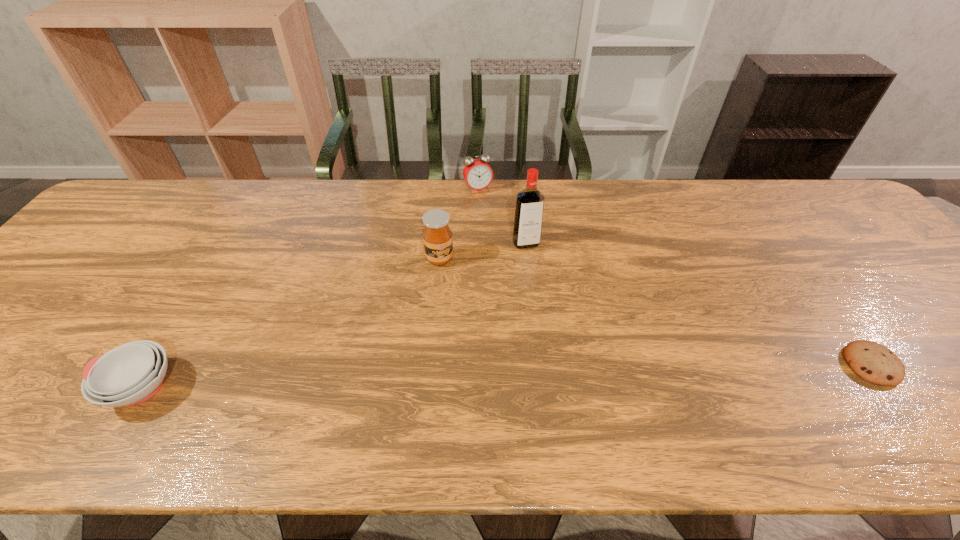
At what (x,y) coordinates should I click in order to perform the action: click on vacant area located on the left of the soup bowl. Please return your answer as a coordinate pair (x, y). This screenshot has height=540, width=960. Looking at the image, I should click on (0, 387).

Locate an element on the screen. This screenshot has width=960, height=540. free space located on the left of the cookie is located at coordinates (676, 364).

Identify the location of free region located on the front and back of the tallest object. (552, 310).

In order to click on free location located 0.210m on the front and back of the tallest object in this screenshot , I will do `click(551, 308)`.

Where is `vacant area situated 0.230m on the front and back of the tallest object`? This screenshot has width=960, height=540. vacant area situated 0.230m on the front and back of the tallest object is located at coordinates (553, 314).

The height and width of the screenshot is (540, 960). Identify the location of free spot located on the front-facing side of the third object from right to left. (527, 284).

Locate an element on the screen. The height and width of the screenshot is (540, 960). free space located on the front-facing side of the third object from right to left is located at coordinates (516, 264).

The width and height of the screenshot is (960, 540). Identify the location of vacant space positioned 0.140m on the front-facing side of the third object from right to left. (496, 222).

At what (x,y) coordinates should I click in order to perform the action: click on vacant space located 0.280m on the front-facing side of the fourth object from right to left. Please return your answer as a coordinate pair (x, y). Looking at the image, I should click on (493, 346).

The height and width of the screenshot is (540, 960). In order to click on blank area located on the front-facing side of the fourth object from right to left in this screenshot , I will do `click(461, 293)`.